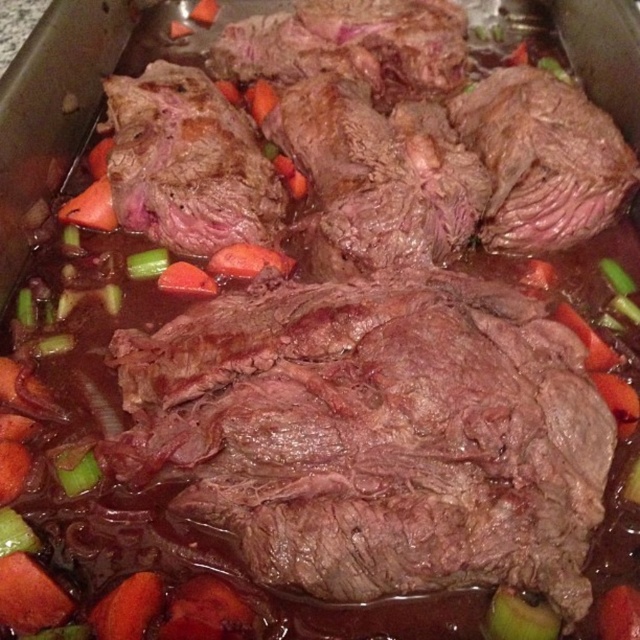
Question: Which of these objects is positioned closest to the green leafy vegetable at center?

Choices:
 (A) green translucent celery at center
 (B) green translucent onion at lower left
 (C) orange carrot at center

Answer: (C)

Question: Which object is closer to the camera taking this photo?

Choices:
 (A) green leafy vegetable at center
 (B) green translucent onion at lower left

Answer: (A)

Question: Is green translucent onion at lower left below green translucent celery at center?

Choices:
 (A) yes
 (B) no

Answer: (A)

Question: Is brown matte steak at center below green leafy vegetable at center?

Choices:
 (A) no
 (B) yes

Answer: (A)

Question: Which point is farther to the camera?

Choices:
 (A) brown matte steak at center
 (B) green translucent onion at lower left

Answer: (B)

Question: Can you confirm if brown matte steak at center is positioned above green translucent onion at lower left?

Choices:
 (A) no
 (B) yes

Answer: (B)